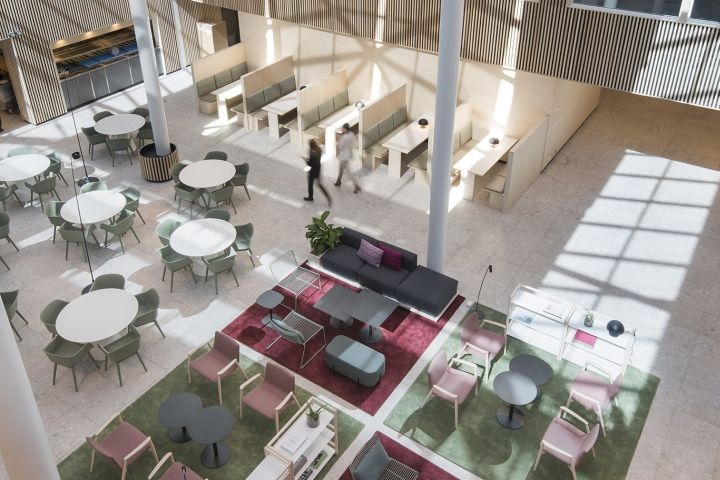
Locate an element on the screen. The height and width of the screenshot is (480, 720). shelves is located at coordinates (534, 305), (531, 326), (531, 342), (600, 326), (603, 348), (598, 361), (307, 430), (318, 446), (320, 463), (271, 469).